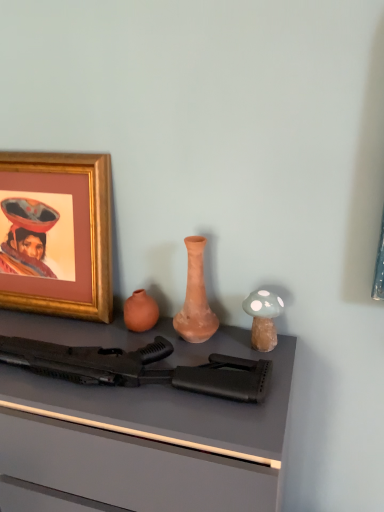
You are a GUI agent. You are given a task and a screenshot of the screen. Output one action in this format:
    pyautogui.click(x=<x>, y=<y>)
    Task: Click on the free space on the front side of matte clay vase at center
    The height and width of the screenshot is (512, 384).
    Given the screenshot: What is the action you would take?
    pyautogui.click(x=194, y=358)